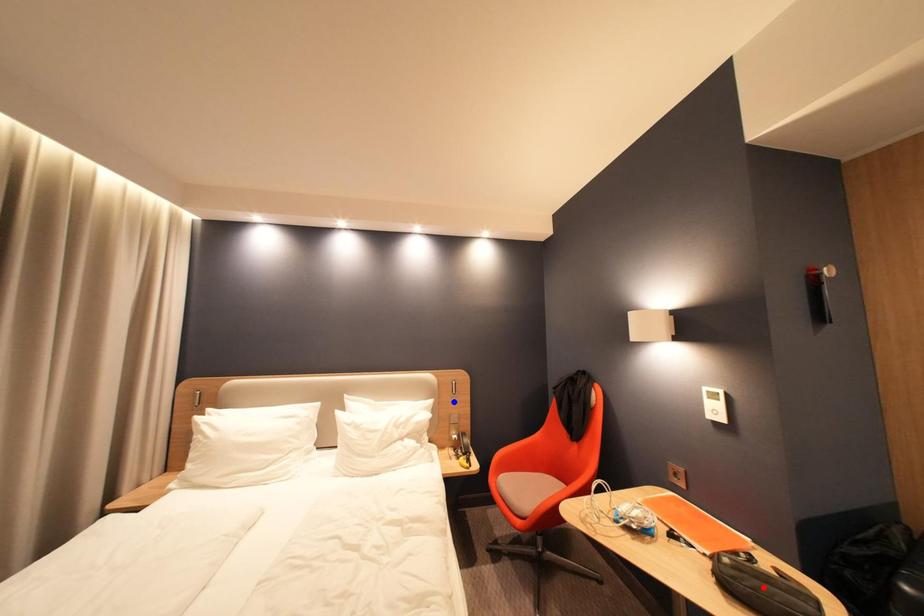
Question: Two points are marked on the image. Which point is closer to the camera?

Choices:
 (A) Blue point is closer.
 (B) Red point is closer.

Answer: (B)